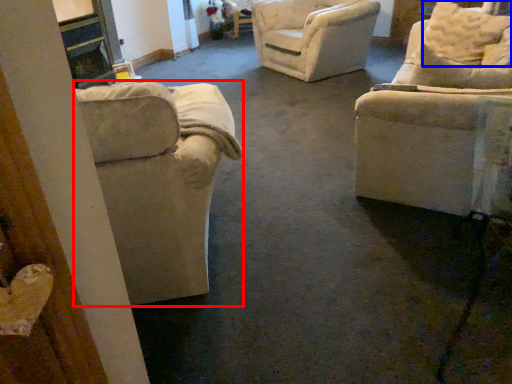
Question: Which object appears closest to the camera in this image, chair (highlighted by a red box) or pillow (highlighted by a blue box)?

Choices:
 (A) chair
 (B) pillow

Answer: (A)